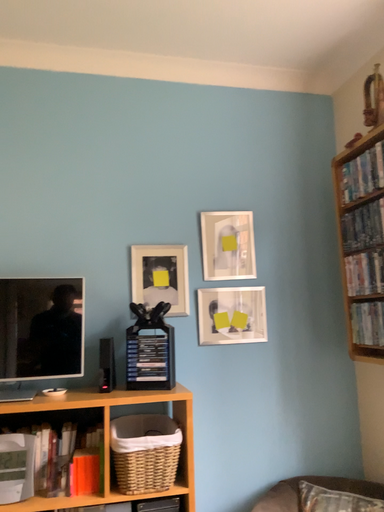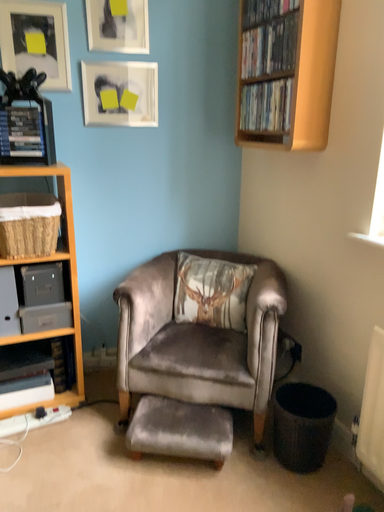
Question: How did the camera likely rotate when shooting the video?

Choices:
 (A) rotated left
 (B) rotated right

Answer: (B)